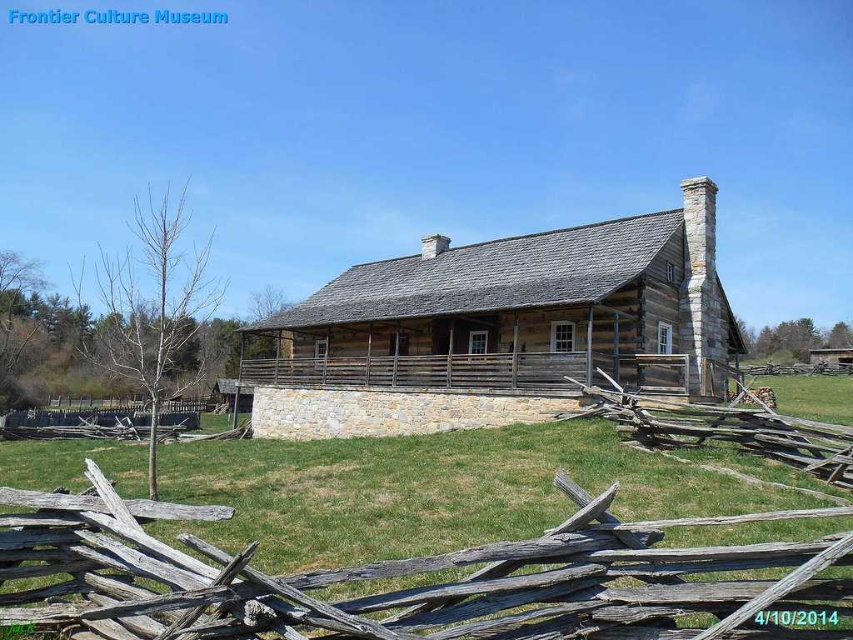
Describe the element at coordinates (407, 576) in the screenshot. Image resolution: width=853 pixels, height=640 pixels. I see `weathered wood fence at lower center` at that location.

Is weathered wood fence at lower center positioned in front of rustic wood cabin at center?

That is True.

This screenshot has width=853, height=640. What are the coordinates of `weathered wood fence at lower center` in the screenshot? It's located at (407, 576).

Where is `weathered wood fence at lower center`? The height and width of the screenshot is (640, 853). weathered wood fence at lower center is located at coordinates (407, 576).